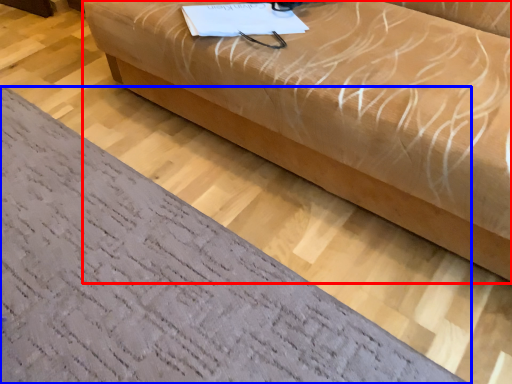
Question: Which point is closer to the camera, studio couch (highlighted by a red box) or furniture (highlighted by a blue box)?

Choices:
 (A) studio couch
 (B) furniture

Answer: (A)